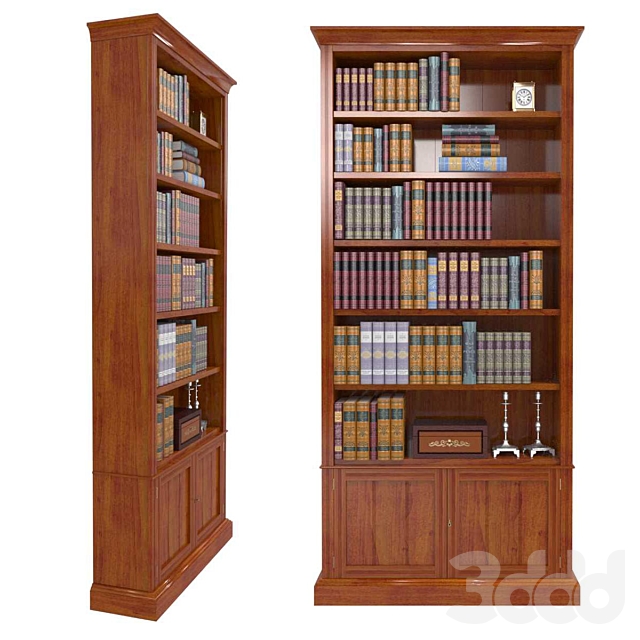
What are the coordinates of `books on bottom shelf of bookcase on right side` in the screenshot? It's located at (397, 420), (383, 431), (372, 436), (363, 440), (352, 445), (338, 448).